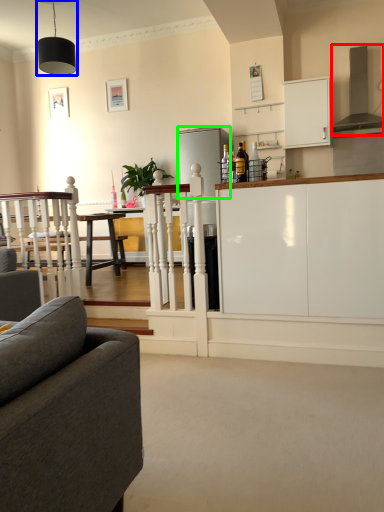
Question: Considering the real-world distances, which object is farthest from exhaust hood (highlighted by a red box)? light fixture (highlighted by a blue box) or appliance (highlighted by a green box)?

Choices:
 (A) light fixture
 (B) appliance

Answer: (A)